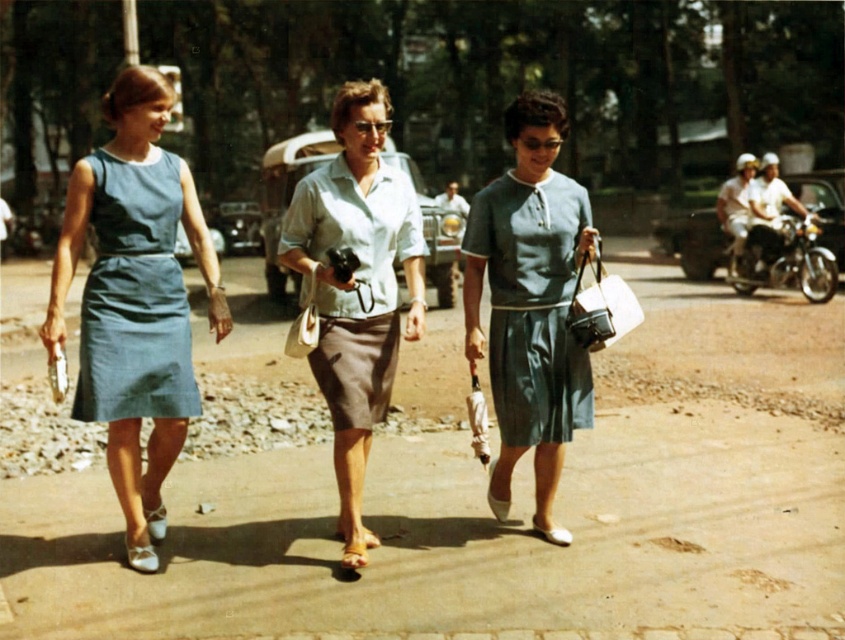
Is light blue fabric blouse at center positioned behind denim dress at left?

No, it is not.

Is light blue fabric blouse at center thinner than denim dress at left?

In fact, light blue fabric blouse at center might be wider than denim dress at left.

This screenshot has width=845, height=640. I want to click on light blue fabric blouse at center, so click(x=356, y=285).

Is matte green skirt at center to the left of denim dress at left from the viewer's perspective?

In fact, matte green skirt at center is to the right of denim dress at left.

Can you confirm if matte green skirt at center is shorter than denim dress at left?

No.

Image resolution: width=845 pixels, height=640 pixels. I want to click on matte green skirt at center, so click(x=530, y=304).

Image resolution: width=845 pixels, height=640 pixels. What are the coordinates of `matte green skirt at center` in the screenshot? It's located at (530, 304).

What do you see at coordinates (530, 304) in the screenshot?
I see `matte green skirt at center` at bounding box center [530, 304].

Who is more forward, (x=544, y=524) or (x=363, y=362)?

Point (x=363, y=362) is in front.

Identify the location of matte green skirt at center. This screenshot has width=845, height=640. (530, 304).